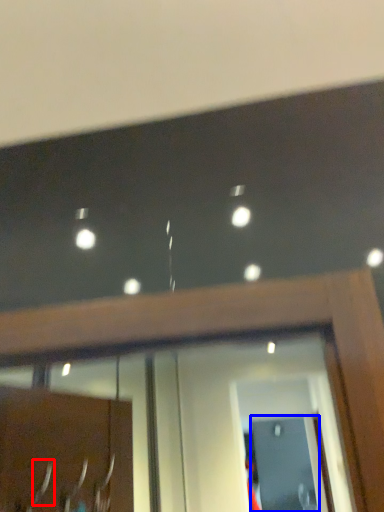
Question: Which object is closer to the camera taking this photo, door handle (highlighted by a red box) or screen door (highlighted by a blue box)?

Choices:
 (A) door handle
 (B) screen door

Answer: (A)